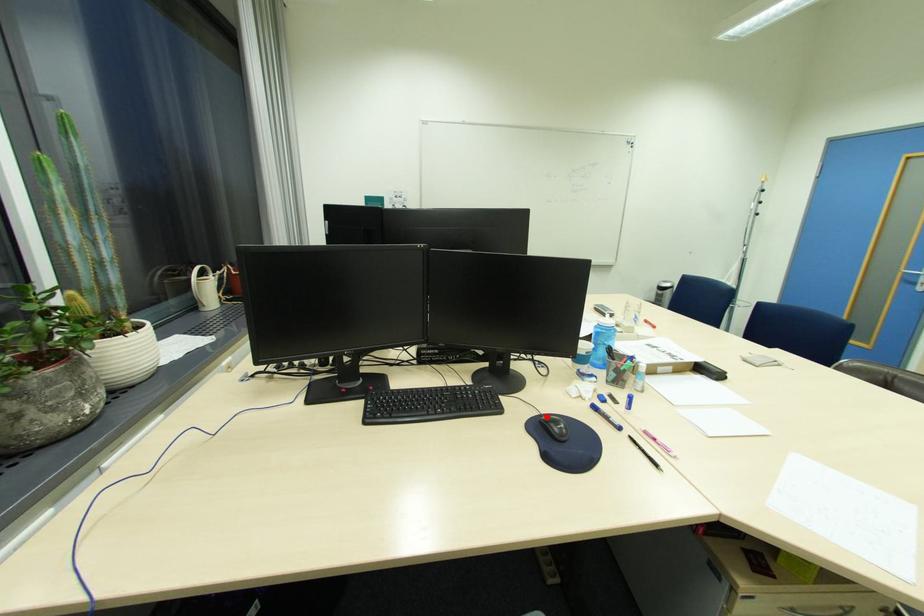
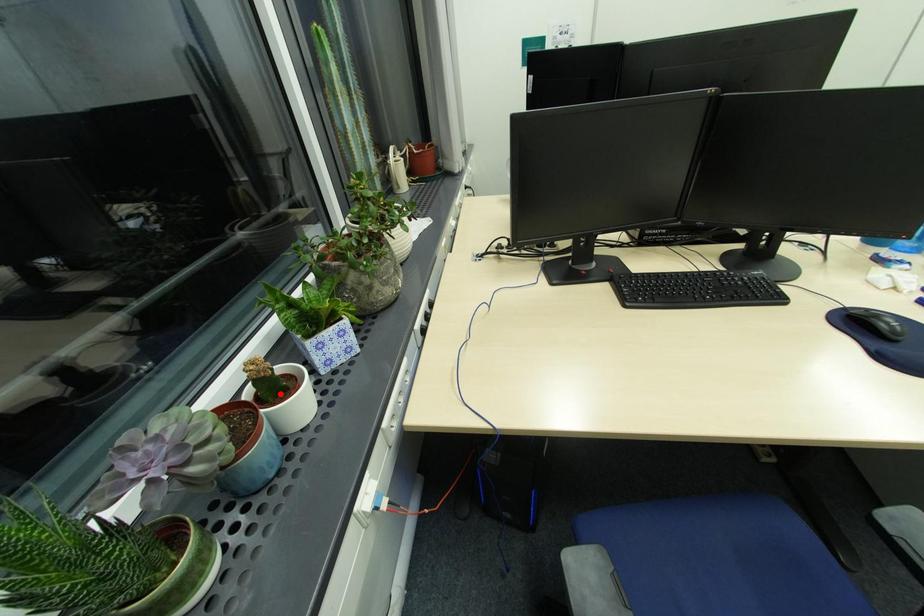
I am providing you with two images of the same scene from different viewpoints. A red point is marked on the first image and another point is marked on the second image. Is the red point in image1 aligned with the point shown in image2?

No